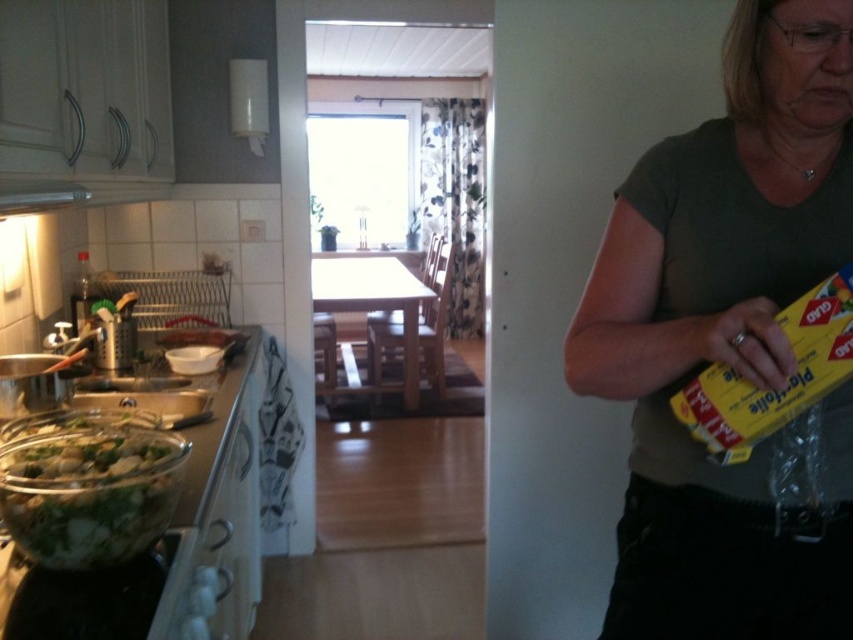
You are a chef preparing a dish and need to quickly move the green leafy vegetables at lower left to the metallic silver exhaust hood at upper left. Given that your reach is about 24 inches, can you do this without moving your position?

The distance between the green leafy vegetables at lower left and the metallic silver exhaust hood at upper left is 17.17 inches. Since your reach is 24 inches, you can easily reach them without moving your position.